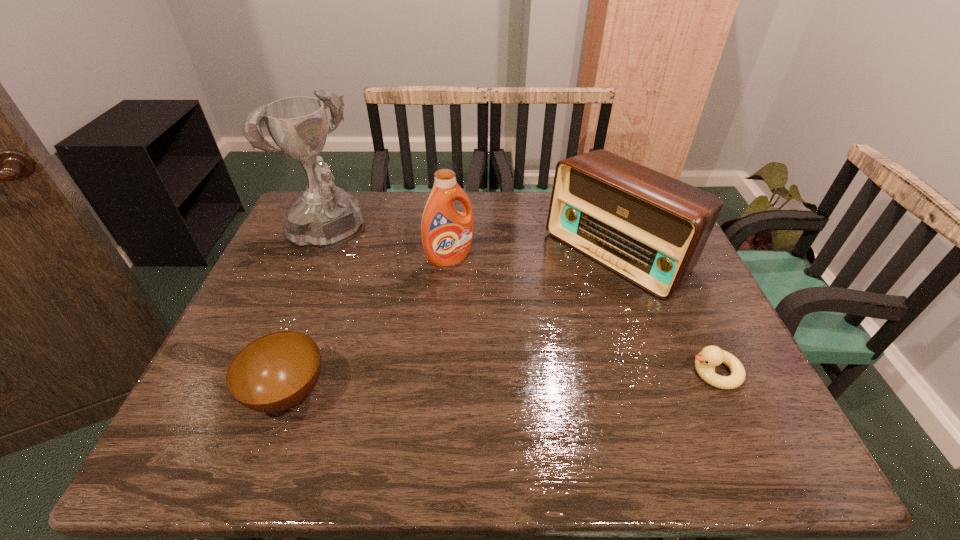
Find the location of a particular element. The height and width of the screenshot is (540, 960). bowl is located at coordinates (274, 373).

Where is `the shortest object`? The width and height of the screenshot is (960, 540). the shortest object is located at coordinates (710, 356).

Locate an element on the screen. The image size is (960, 540). the second tallest object is located at coordinates (447, 234).

Image resolution: width=960 pixels, height=540 pixels. In order to click on detergent in this screenshot , I will do `click(447, 234)`.

Find the location of a particular element. The width and height of the screenshot is (960, 540). award is located at coordinates (326, 216).

This screenshot has width=960, height=540. What are the coordinates of `the third shortest object` in the screenshot? It's located at (649, 228).

This screenshot has height=540, width=960. What are the coordinates of `free space located on the back of the fourth tallest object` in the screenshot? It's located at (309, 336).

Identify the location of vacant space located 0.330m at the beak of the duckling. This screenshot has height=540, width=960. coord(543,372).

Find the location of `free space located at the beak of the duckling`. free space located at the beak of the duckling is located at coordinates (535, 372).

Locate an element on the screen. free space located at the beak of the duckling is located at coordinates (547, 372).